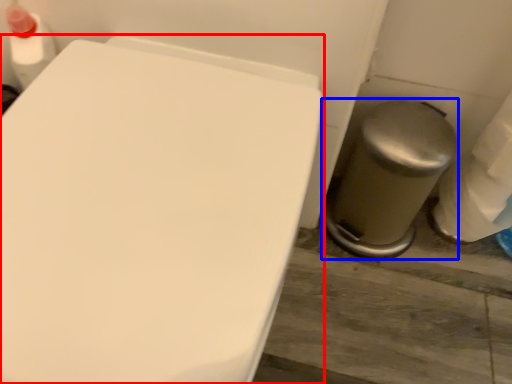
Question: Which point is closer to the camera, toilet (highlighted by a red box) or porcelain (highlighted by a blue box)?

Choices:
 (A) toilet
 (B) porcelain

Answer: (A)